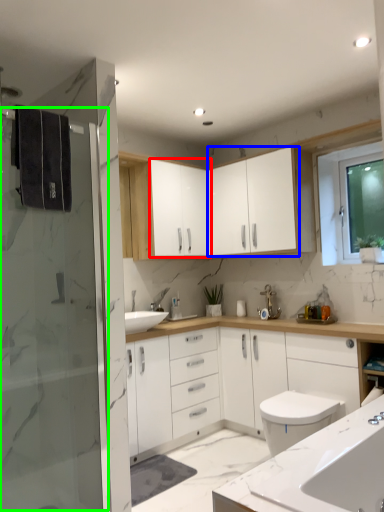
Question: Estimate the real-world distances between objects in this image. Which object is closer to cabinetry (highlighted by a red box), cabinetry (highlighted by a blue box) or screen door (highlighted by a green box)?

Choices:
 (A) cabinetry
 (B) screen door

Answer: (A)